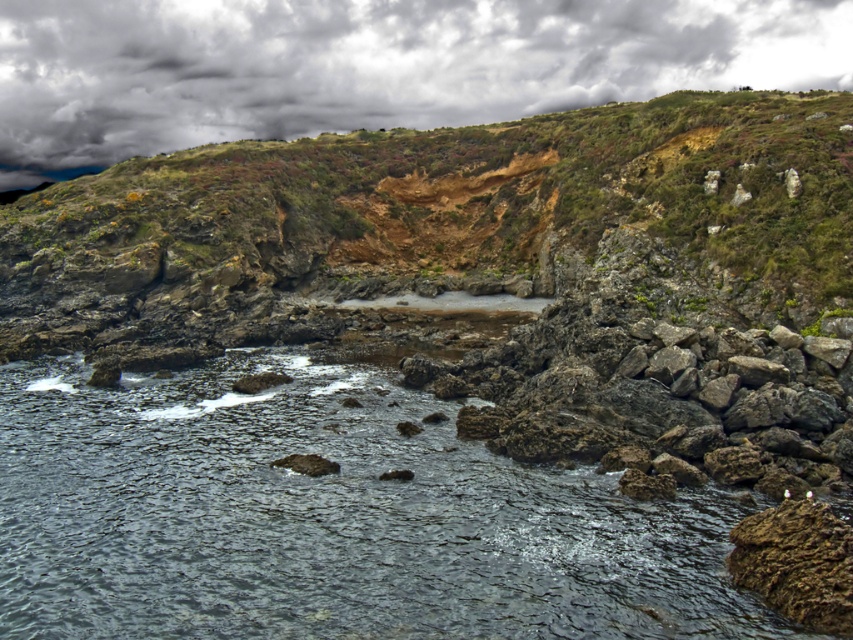
You are standing at the edge of the cliff overlooking the coastal landscape. You notice two points marked in the image. Which point, point (x=711, y=506) or point (x=521, y=460), is closer to your current position?

Point (x=711, y=506) is closer to the camera than point (x=521, y=460), so it is closer to your current position at the cliff edge.

You are standing on the beach looking towards the cliffs. Which cliff is closer to your left side, the rugged rock cliff at center or the rough stone cliff at center?

The rugged rock cliff at center is to the left of the rough stone cliff at center, so it is closer to your left side.